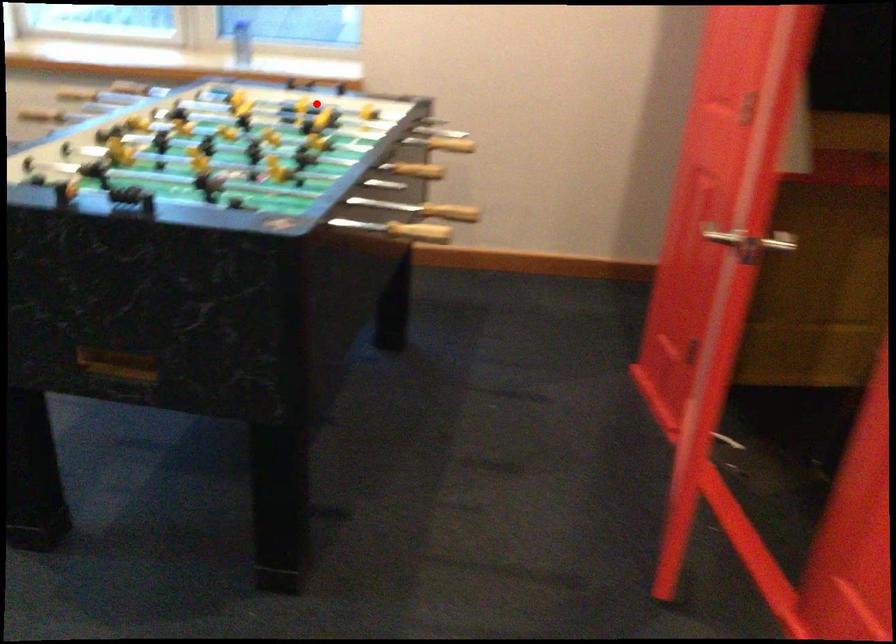
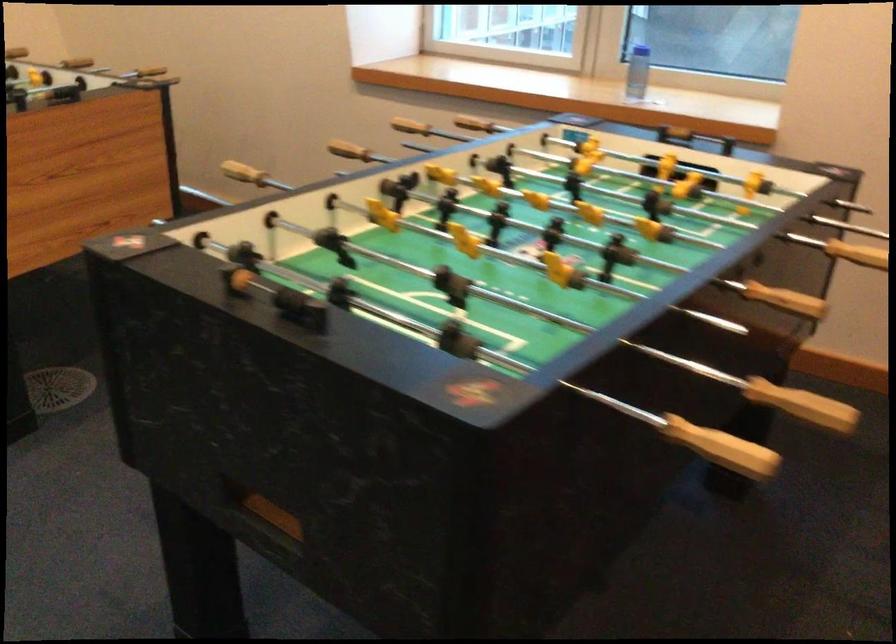
Question: I am providing you with two images of the same scene from different viewpoints. A red point is shown in image1. For the corresponding object point in image2, is it positioned nearer or farther from the camera?

Choices:
 (A) Nearer
 (B) Farther

Answer: (A)